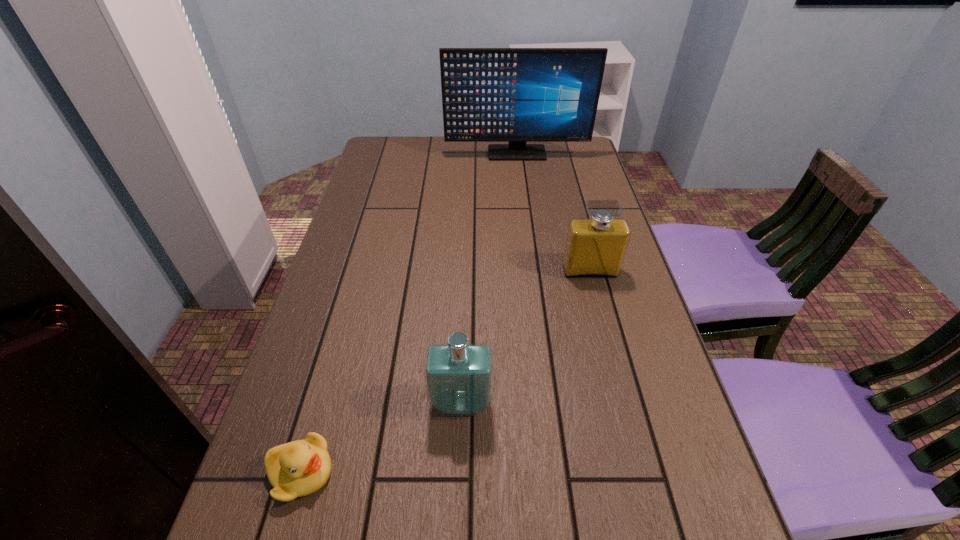
In order to click on vacant space located 0.120m on the front label of the left perfume in this screenshot , I will do `click(458, 484)`.

I want to click on vacant space situated at the face of the duckling, so click(x=423, y=472).

You are a GUI agent. You are given a task and a screenshot of the screen. Output one action in this format:
    pyautogui.click(x=<x>, y=<y>)
    Task: Click on the object present at the far edge
    This screenshot has width=960, height=540.
    Given the screenshot: What is the action you would take?
    [x=517, y=95]

At what (x,y) coordinates should I click in order to perform the action: click on object that is at the left edge. Please return your answer as a coordinate pair (x, y). Looking at the image, I should click on (299, 468).

The height and width of the screenshot is (540, 960). I want to click on computer monitor present at the right edge, so click(x=517, y=95).

Find the location of `perfume that is positioned at the right edge`. perfume that is positioned at the right edge is located at coordinates (595, 247).

The width and height of the screenshot is (960, 540). I want to click on object positioned at the far right corner, so click(x=517, y=95).

In the image, there is a desktop. At what (x,y) coordinates should I click in order to perform the action: click on free space at the far edge. Please return your answer as a coordinate pair (x, y). The image size is (960, 540). Looking at the image, I should click on (523, 167).

The image size is (960, 540). In the image, there is a desktop. What are the coordinates of `vacant region at the left edge` in the screenshot? It's located at (380, 172).

Identify the location of free region at the right edge of the desktop. The image size is (960, 540). [x=636, y=471].